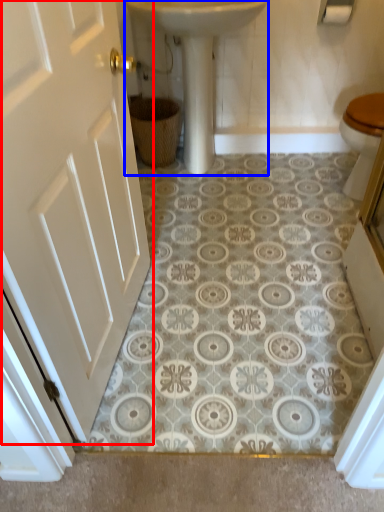
Question: Which object appears farthest to the camera in this image, door (highlighted by a red box) or sink (highlighted by a blue box)?

Choices:
 (A) door
 (B) sink

Answer: (B)